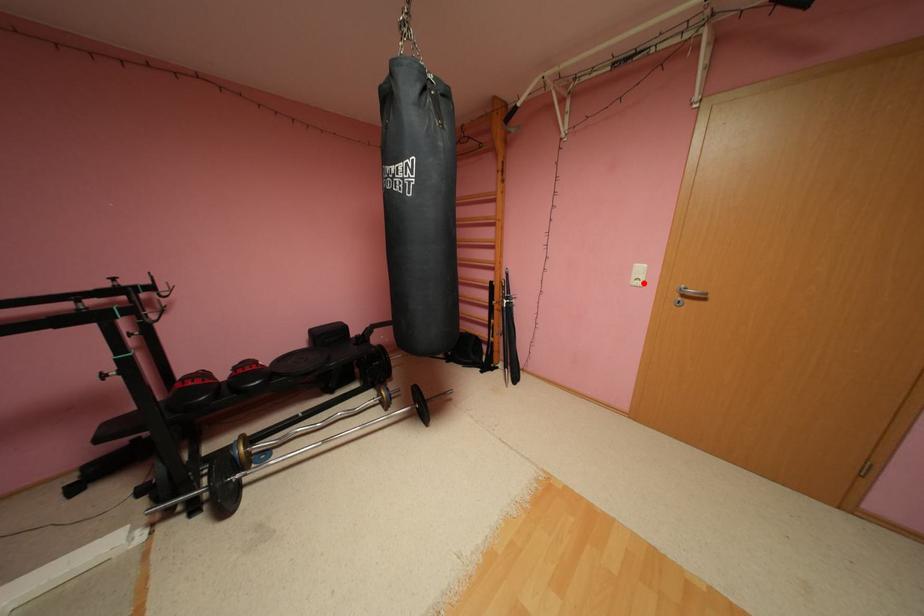
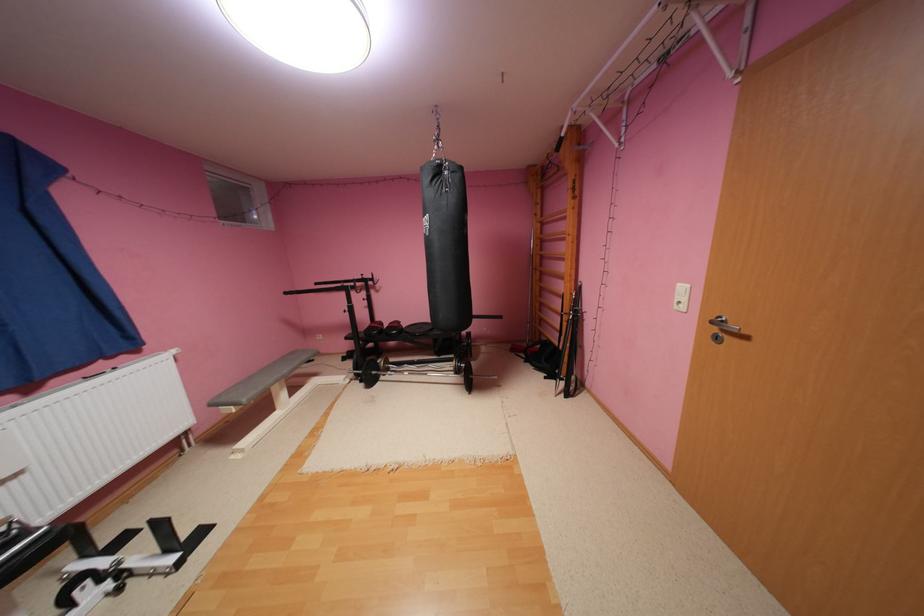
Locate, in the second image, the point that corresponds to the highlighted location in the first image.

(686, 306)